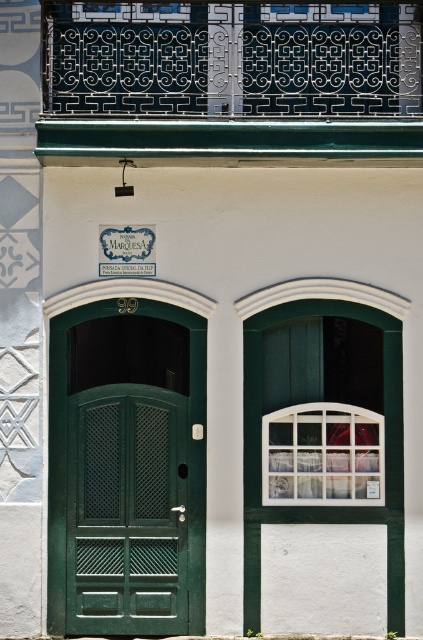
Is white glass window at center below metallic glass window at upper center?

Yes.

Can you confirm if white glass window at center is taller than metallic glass window at upper center?

Correct, white glass window at center is much taller as metallic glass window at upper center.

Identify the location of white glass window at center. The width and height of the screenshot is (423, 640). (323, 456).

The width and height of the screenshot is (423, 640). I want to click on white glass window at center, so click(323, 456).

Who is taller, green matte door at left or metallic glass window at upper center?

Standing taller between the two is green matte door at left.

Where is `green matte door at left`? green matte door at left is located at coordinates (126, 468).

Between point (128, 394) and point (291, 408), which one is positioned behind?

Positioned behind is point (128, 394).

Who is more forward, (63,556) or (269,472)?

Point (269,472) is in front.

Identify the location of green matte door at left. (126, 468).